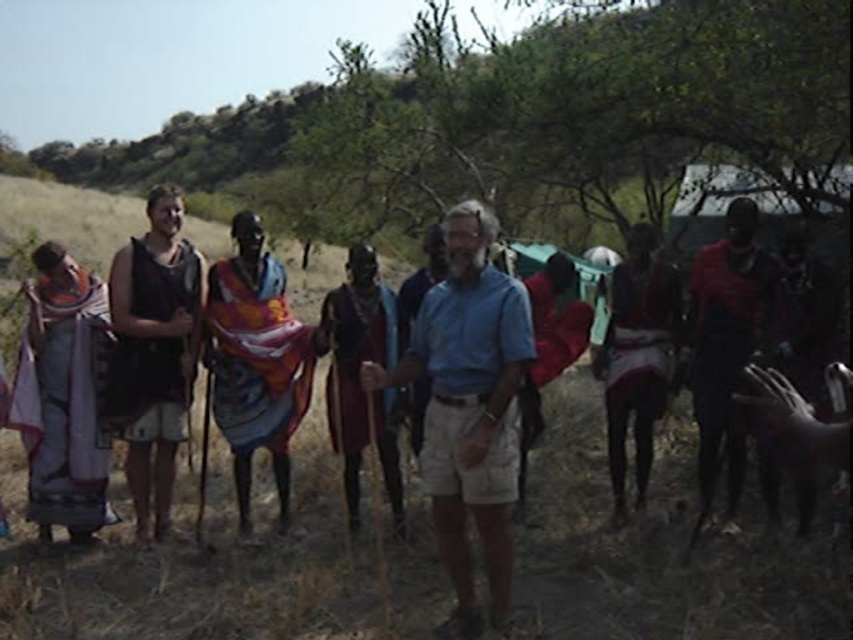
Which is in front, point (738, 368) or point (625, 259)?

Positioned in front is point (738, 368).

In order to click on dark red fabric at right in this screenshot , I will do `click(724, 348)`.

Between point (88, 534) and point (247, 420), which one is positioned in front?

Point (88, 534)

Does textured fabric shawl at left have a greater width compared to multicolored fabric at center?

No, textured fabric shawl at left is not wider than multicolored fabric at center.

Is point (82, 467) less distant than point (252, 269)?

That is True.

Where is `textured fabric shawl at left`? Image resolution: width=853 pixels, height=640 pixels. textured fabric shawl at left is located at coordinates (62, 397).

Does black fabric at left appear over dark brown leather dress at center?

No, black fabric at left is not above dark brown leather dress at center.

Who is taller, black fabric at left or dark brown leather dress at center?

dark brown leather dress at center is taller.

Between point (198, 262) and point (332, 320), which one is positioned behind?

The point (332, 320) is behind.

Locate an element on the screen. black fabric at left is located at coordinates (154, 353).